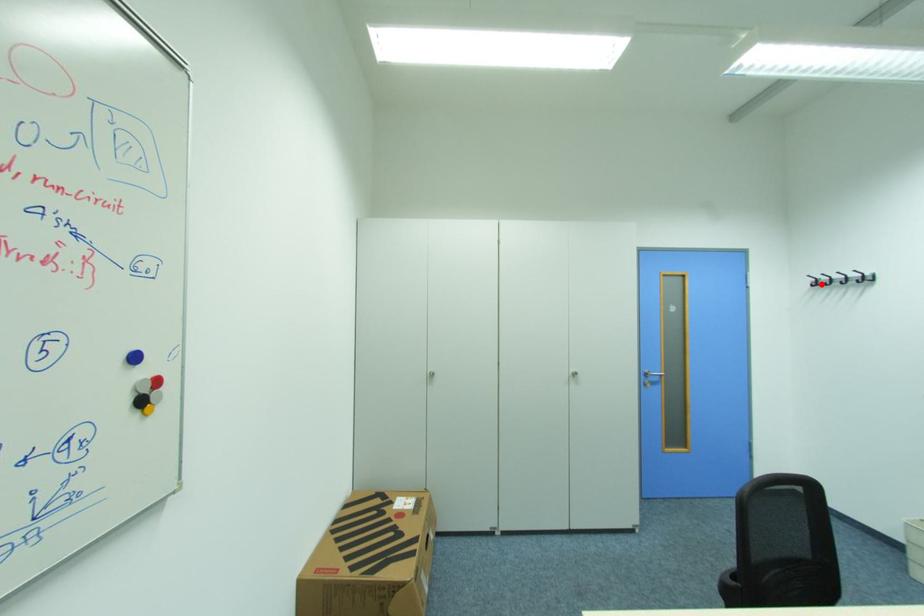
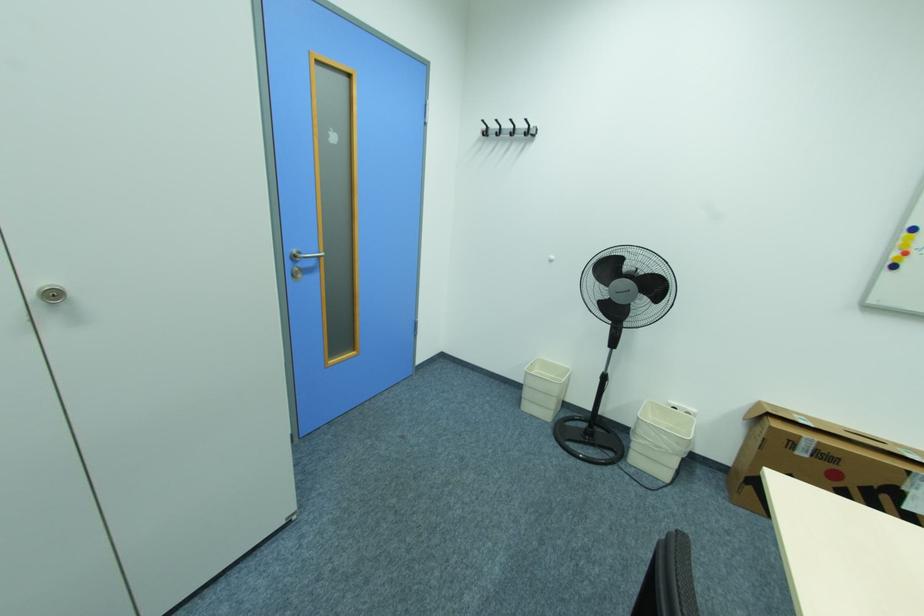
Locate, in the second image, the point that corresponds to the highlighted location in the first image.

(492, 132)